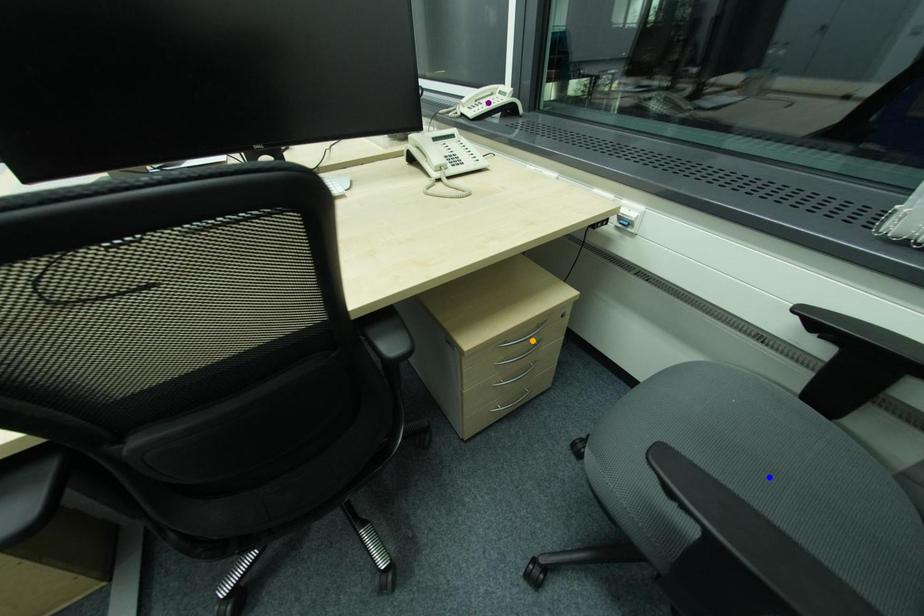
Order these from nearest to farthest:
blue point, orange point, purple point

blue point < orange point < purple point